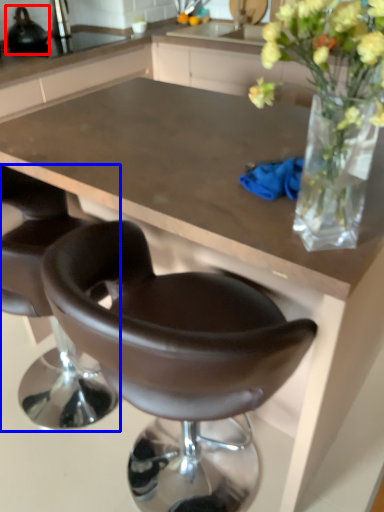
Question: Among these objects, which one is nearest to the camera, appliance (highlighted by a red box) or chair (highlighted by a blue box)?

Choices:
 (A) appliance
 (B) chair

Answer: (B)